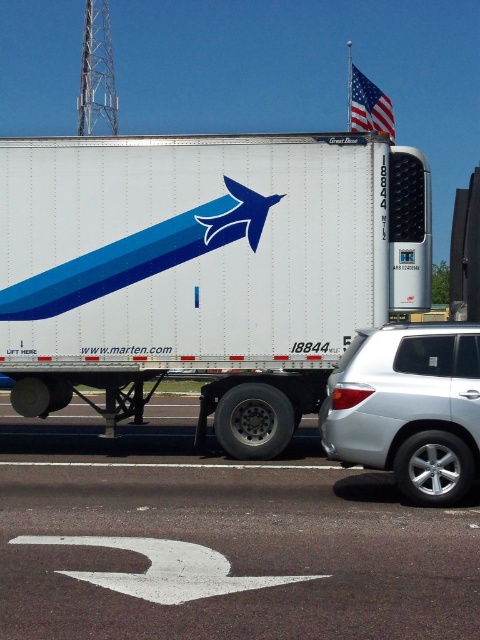
You are a driver approaching the white asphalt road at lower center and the silver metallic suv at right. Which object is closer to the left side of the road?

The white asphalt road at lower center is positioned on the left side of the silver metallic suv at right, so the road is closer to the left side of the road.

You are driving a car and see the white asphalt road at lower center and the silver metallic suv at right. Which object is closer to you?

The white asphalt road at lower center is closer to the viewer than the silver metallic suv at right.

You are a delivery driver planning to pass a white matte trailer at center on a highway. There is an american flag at upper right in your line of sight. Can you safely pass the trailer without hitting the flag?

The white matte trailer at center is not as tall as the american flag at upper right, so you can safely pass the trailer without hitting the flag.